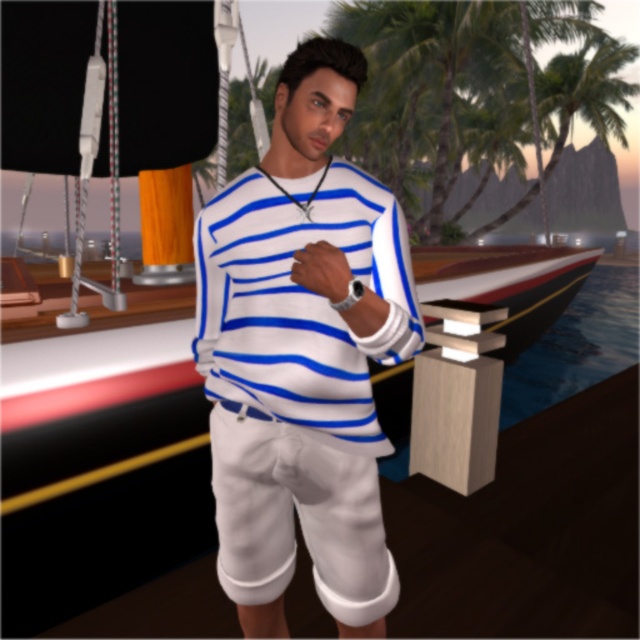
Does white matte sweater at center lie behind white striped sweater at center?

No, white matte sweater at center is closer to the viewer.

Which is below, white matte sweater at center or white striped sweater at center?

white matte sweater at center

Is point (216, 461) farther from viewer compared to point (291, 300)?

That is True.

I want to click on white matte sweater at center, so click(301, 355).

Which is behind, point (349, 26) or point (291, 513)?

Positioned behind is point (349, 26).

In the scene shown: Is green leafy palm tree at upper center smaller than white cotton shorts at center?

Actually, green leafy palm tree at upper center might be larger than white cotton shorts at center.

Between point (374, 147) and point (323, 593), which one is positioned behind?

The point (374, 147) is behind.

At what (x,y) coordinates should I click in order to perform the action: click on green leafy palm tree at upper center. Please return your answer as a coordinate pair (x, y). This screenshot has width=640, height=640. Looking at the image, I should click on (445, 90).

What are the coordinates of `white matte sweater at center` in the screenshot? It's located at (301, 355).

Who is positioned more to the right, white matte sweater at center or white cotton shorts at center?

From the viewer's perspective, white matte sweater at center appears more on the right side.

Is point (340, 500) closer to camera compared to point (216, 572)?

Yes, point (340, 500) is closer to viewer.

Find the location of a particular element. white matte sweater at center is located at coordinates (301, 355).